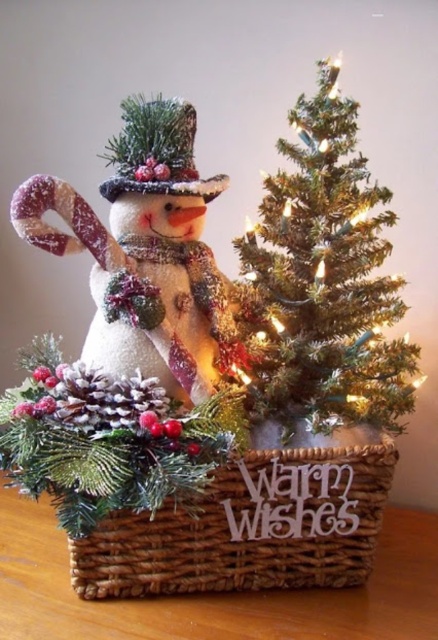
You are setting up a holiday display and need to place a decorative item exactly at the point marked by coordinates point (110, 253). If your camera is positioned 48 inches away from the display surface, will the point be within the camera frame?

The point (110, 253) is 36.22 inches away from the camera, which is within the 48 inches distance, so yes, the point will be within the camera frame.

You are setting up a holiday display and need to place a small decoration between the frosted fabric snowman at center and the woven brown basket at center. Which object should the decoration be placed closer to if it needs to be lower to the ground?

The decoration should be placed closer to the woven brown basket at center because it is shorter than the frosted fabric snowman at center.

You are setting up a holiday display and want to ensure the green textured christmas tree at center and the frosted fabric snowman at center are spaced appropriately. Based on their widths, which object requires more horizontal space to accommodate its width?

The frosted fabric snowman at center requires more horizontal space because it has a greater width than the green textured christmas tree at center.